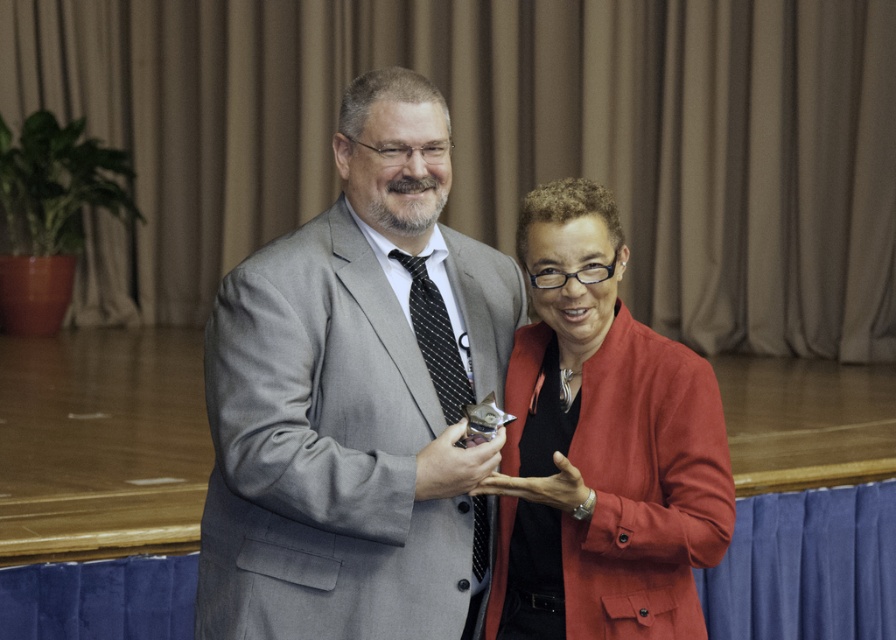
Question: Which point appears farthest from the camera in this image?

Choices:
 (A) (281, 477)
 (B) (674, 600)

Answer: (B)

Question: Which object appears closest to the camera in this image?

Choices:
 (A) gray suit at center
 (B) matte red blazer at center

Answer: (A)

Question: Can you confirm if gray suit at center is bigger than matte red blazer at center?

Choices:
 (A) no
 (B) yes

Answer: (B)

Question: Is gray suit at center to the right of matte red blazer at center from the viewer's perspective?

Choices:
 (A) no
 (B) yes

Answer: (A)

Question: Does gray suit at center come behind matte red blazer at center?

Choices:
 (A) no
 (B) yes

Answer: (A)

Question: Which object is closer to the camera taking this photo?

Choices:
 (A) matte red blazer at center
 (B) gray suit at center

Answer: (B)